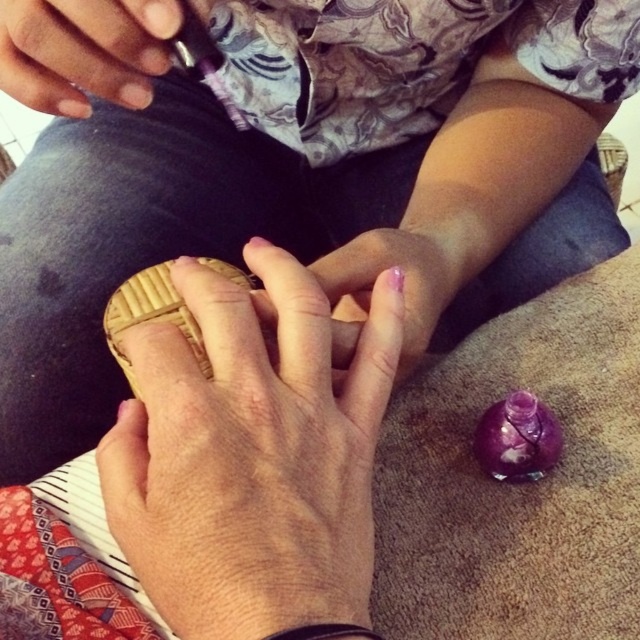
Is point (129, 67) positioned behind point (173, 317)?

Yes, point (129, 67) is behind point (173, 317).

What do you see at coordinates (84, 51) in the screenshot? I see `metallic ring at upper left` at bounding box center [84, 51].

Is point (65, 19) closer to camera compared to point (266, 332)?

No.

The height and width of the screenshot is (640, 640). What are the coordinates of `metallic ring at upper left` in the screenshot? It's located at (84, 51).

Who is positioned more to the left, metallic ring at upper left or pink polished nails at center?

Positioned to the left is metallic ring at upper left.

Between metallic ring at upper left and pink polished nails at center, which one has more height?

pink polished nails at center

In the scene shown: Measure the distance between point [33,88] and camera.

The distance of point [33,88] from camera is 12.85 inches.

At what (x,y) coordinates should I click in order to perform the action: click on metallic ring at upper left. Please return your answer as a coordinate pair (x, y). Looking at the image, I should click on (84, 51).

Is smooth skin hand at center below metallic ring at upper left?

Correct, smooth skin hand at center is located below metallic ring at upper left.

Does point (392, 304) lie behind point (80, 29)?

No.

Which is behind, point (237, 344) or point (26, 81)?

Point (26, 81)

Identify the location of smooth skin hand at center. The image size is (640, 640). (252, 456).